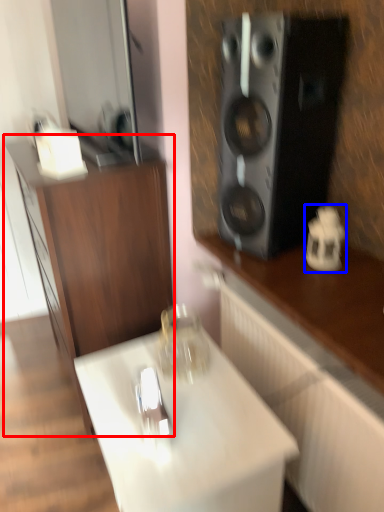
Question: Which object is further to the camera taking this photo, cabinetry (highlighted by a red box) or appliance (highlighted by a blue box)?

Choices:
 (A) cabinetry
 (B) appliance

Answer: (B)